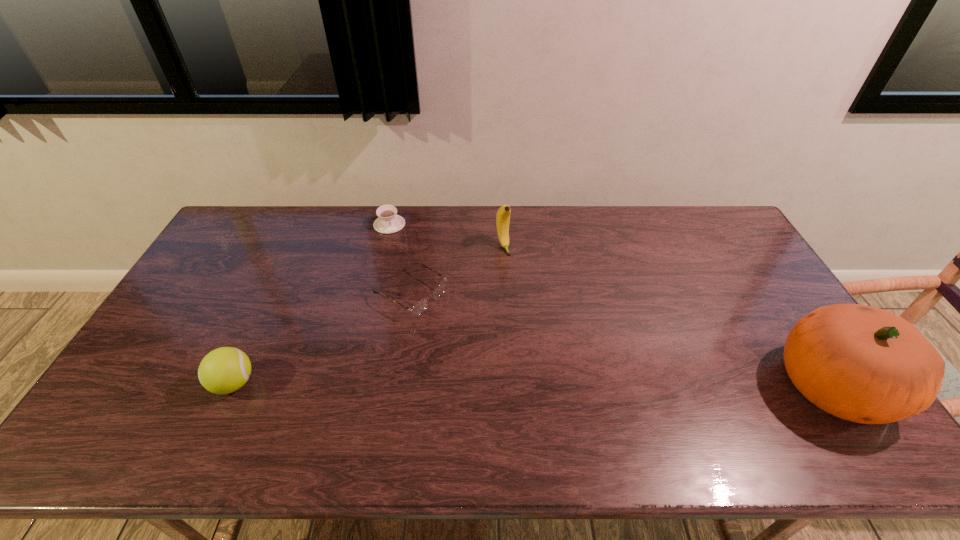
The image size is (960, 540). I want to click on the third tallest object, so click(224, 370).

This screenshot has width=960, height=540. In order to click on tennis ball in this screenshot , I will do `click(224, 370)`.

The width and height of the screenshot is (960, 540). In order to click on pumpkin in this screenshot , I will do `click(860, 363)`.

Find the location of `the tallest object`. the tallest object is located at coordinates (860, 363).

This screenshot has height=540, width=960. I want to click on the third nearest object, so click(x=418, y=308).

At what (x,y) coordinates should I click in order to perform the action: click on the second tallest object. Please return your answer as a coordinate pair (x, y). The height and width of the screenshot is (540, 960). Looking at the image, I should click on (503, 214).

Locate an element on the screen. the second farthest object is located at coordinates (503, 214).

Image resolution: width=960 pixels, height=540 pixels. Identify the location of teacup. (388, 222).

This screenshot has width=960, height=540. Find the location of `vacant space located on the right of the third tallest object`. vacant space located on the right of the third tallest object is located at coordinates (382, 383).

Image resolution: width=960 pixels, height=540 pixels. Find the location of `free space located 0.330m on the front-facing side of the spectacles`. free space located 0.330m on the front-facing side of the spectacles is located at coordinates (531, 366).